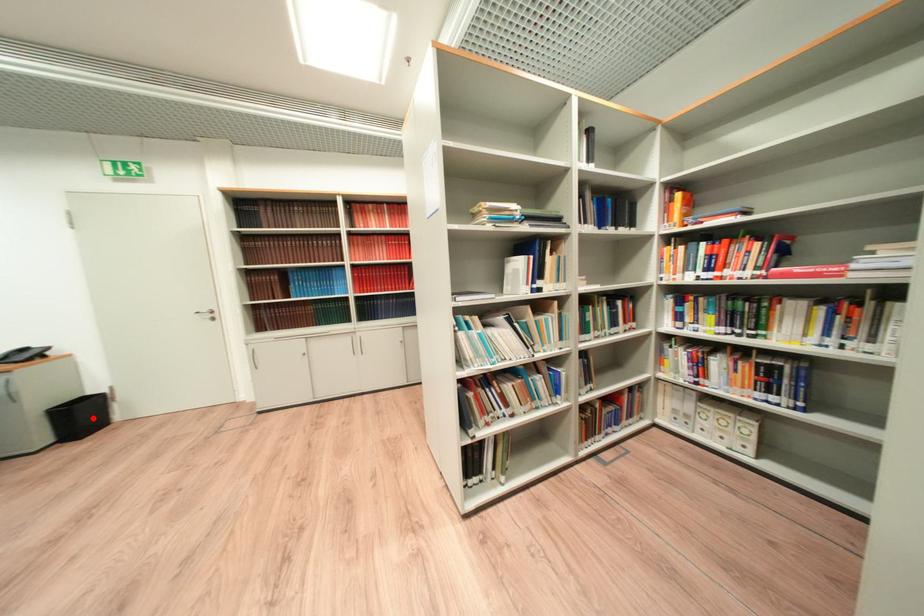
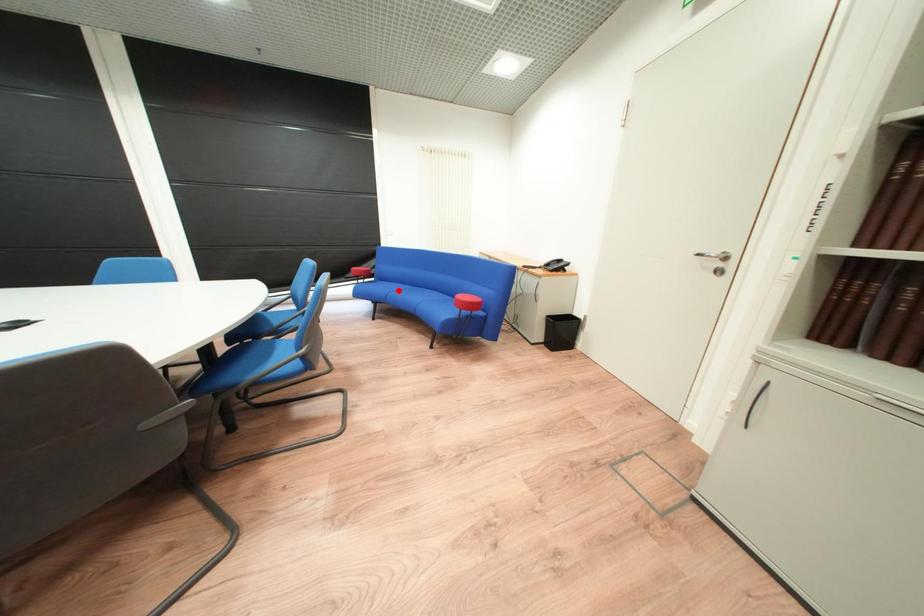
I am providing you with two images of the same scene from different viewpoints. A red point is marked on the first image and another point is marked on the second image. Do the highlighted points in image1 and image2 indicate the same real-world spot?

No